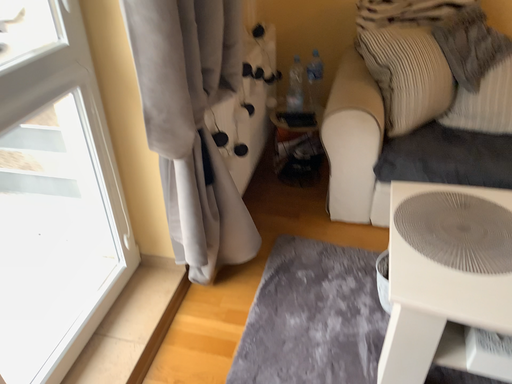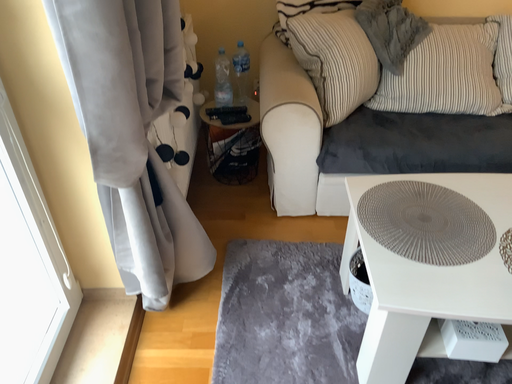
Question: Which way did the camera rotate in the video?

Choices:
 (A) rotated right
 (B) rotated left

Answer: (A)